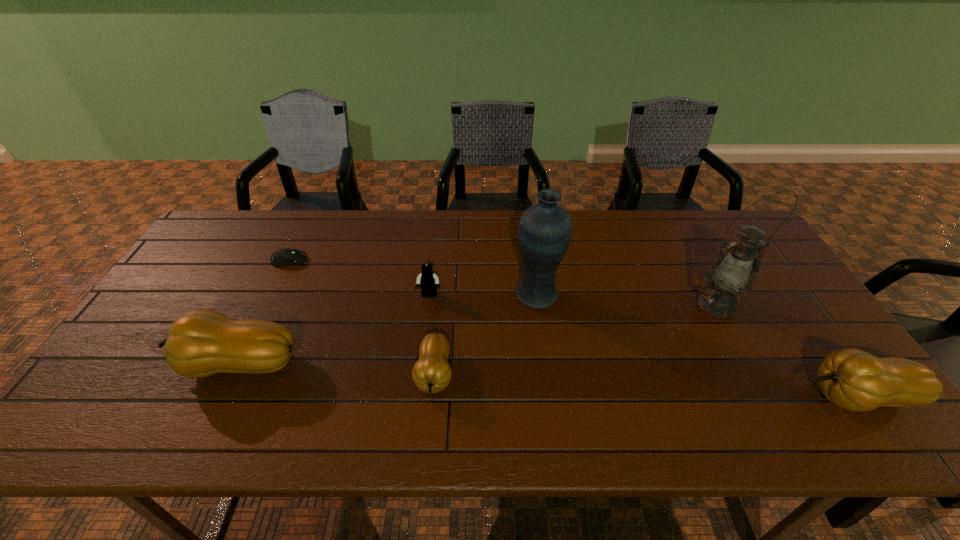
You are a GUI agent. You are given a task and a screenshot of the screen. Output one action in this format:
    pyautogui.click(x=<x>, y=<y>)
    Task: Click on the leftmost gourd
    The width and height of the screenshot is (960, 540).
    Given the screenshot: What is the action you would take?
    pyautogui.click(x=205, y=342)

Locate an element on the screen. the second shortest object is located at coordinates (432, 373).

Where is `the second gourd from right to left`? The width and height of the screenshot is (960, 540). the second gourd from right to left is located at coordinates (432, 373).

This screenshot has width=960, height=540. I want to click on the rightmost object, so click(852, 379).

Find the location of `the rightmost gourd`. the rightmost gourd is located at coordinates (852, 379).

You are a GUI agent. You are given a task and a screenshot of the screen. Output one action in this format:
    pyautogui.click(x=<x>, y=<y>)
    Task: Click on the shortest object
    
    Given the screenshot: What is the action you would take?
    pyautogui.click(x=283, y=257)

Locate an element on the screen. This screenshot has height=540, width=960. the farthest object is located at coordinates (283, 257).

Image resolution: width=960 pixels, height=540 pixels. I want to click on oil lamp, so click(x=734, y=273).

Where is `vase`? The image size is (960, 540). vase is located at coordinates (545, 229).

Locate an element on the screen. The width and height of the screenshot is (960, 540). the fifth object from left to right is located at coordinates (545, 229).